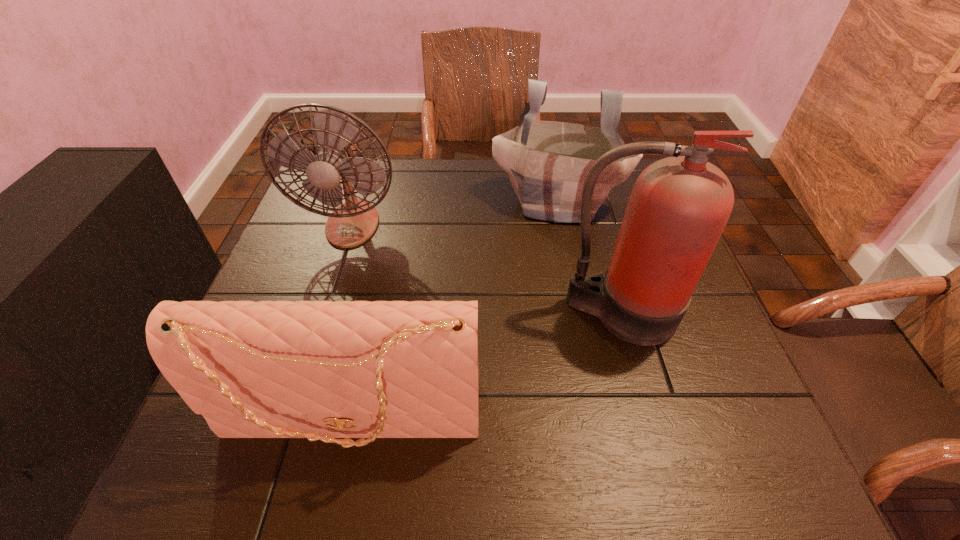
I want to click on vacant region at the left edge, so click(x=319, y=241).

This screenshot has width=960, height=540. I want to click on vacant space at the right edge, so click(699, 331).

Where is `free space at the near left corner of the desktop`? Image resolution: width=960 pixels, height=540 pixels. free space at the near left corner of the desktop is located at coordinates (284, 452).

This screenshot has height=540, width=960. Find the location of `free spot between the shopping bag and the fan`. free spot between the shopping bag and the fan is located at coordinates 455,213.

What are the coordinates of `free area in between the fan and the shopping bag` in the screenshot? It's located at (455, 213).

Find the location of `vacant space that's between the fire extinguisher and the fan`. vacant space that's between the fire extinguisher and the fan is located at coordinates (486, 269).

This screenshot has width=960, height=540. I want to click on free space that is in between the shopping bag and the fan, so click(x=455, y=213).

At what (x,y) coordinates should I click in order to perform the action: click on free space between the fan and the third farthest object. Please return your answer as a coordinate pair (x, y). This screenshot has height=540, width=960. Looking at the image, I should click on (486, 269).

At what (x,y) coordinates should I click in order to perform the action: click on vacant area that lies between the handbag and the second nearest object. Please return your answer as a coordinate pair (x, y). Looking at the image, I should click on (487, 366).

In order to click on vacant region between the fan and the fire extinguisher in this screenshot , I will do `click(486, 269)`.